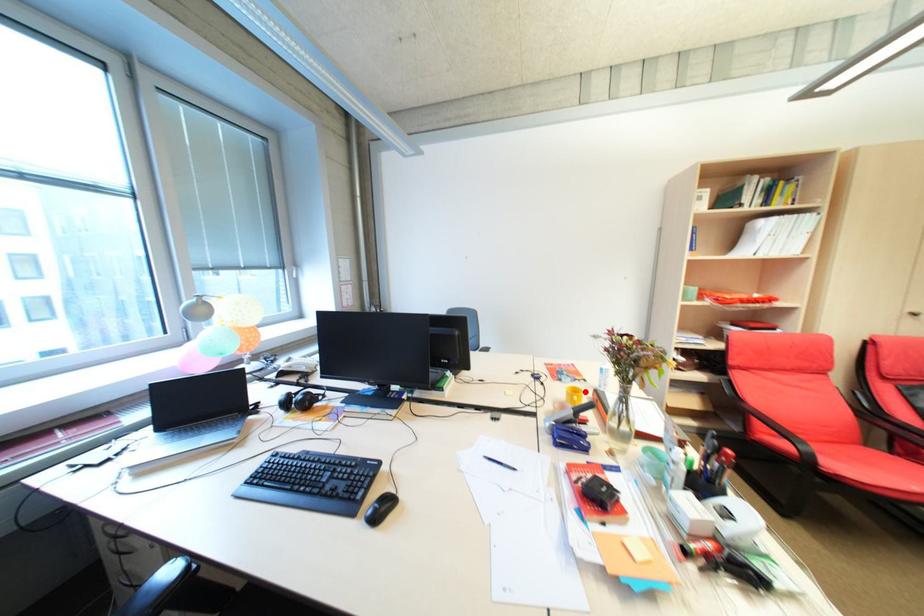
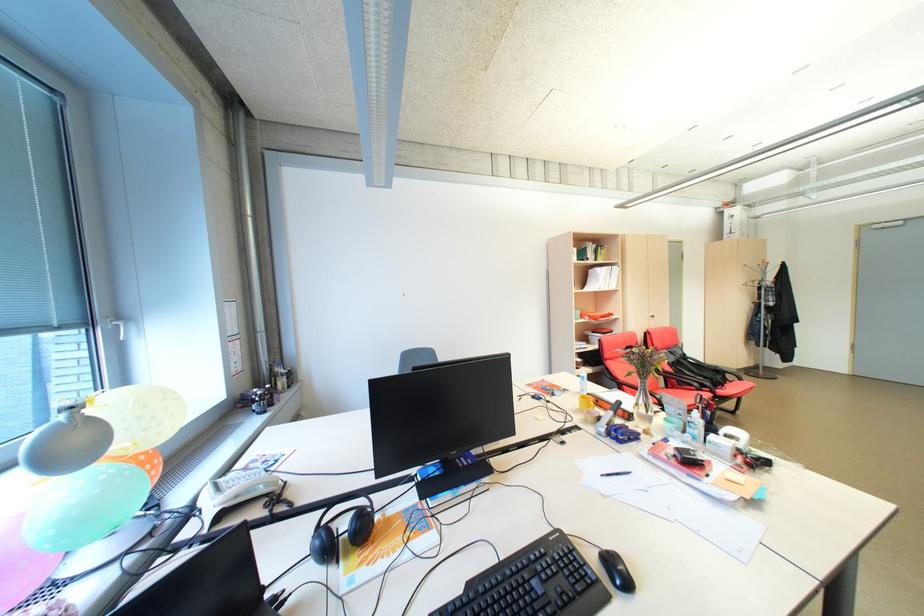
Where in the second image is the point corresponding to the highlighted location from the first image?

(592, 399)